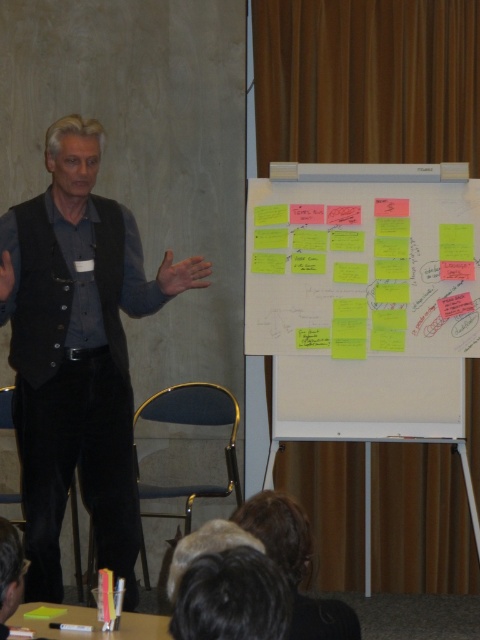
You are an attendee at the presentation. You notice the yellow sticky notes at center and the black matte vest at left. Which object is shorter in height?

The yellow sticky notes at center has a lesser height compared to the black matte vest at left, so the yellow sticky notes at center is shorter in height.

Consider the image. You are an attendee at this presentation. You notice the yellow sticky notes at center and the black matte vest at left. Which object is positioned to the right side of the other?

The yellow sticky notes at center is to the right of black matte vest at left.

Where are the yellow sticky notes at center located in the image?

The yellow sticky notes at center are located at point (363, 298) in the image.